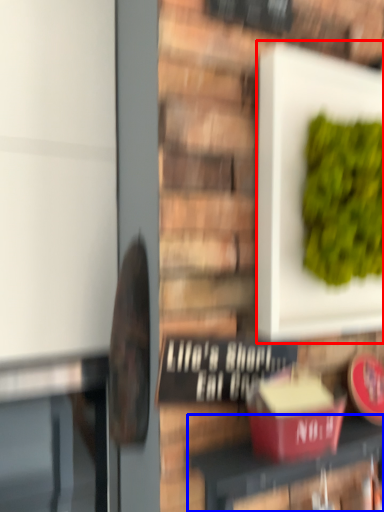
Question: Which point is closer to the camera, square (highlighted by a red box) or furniture (highlighted by a blue box)?

Choices:
 (A) square
 (B) furniture

Answer: (B)